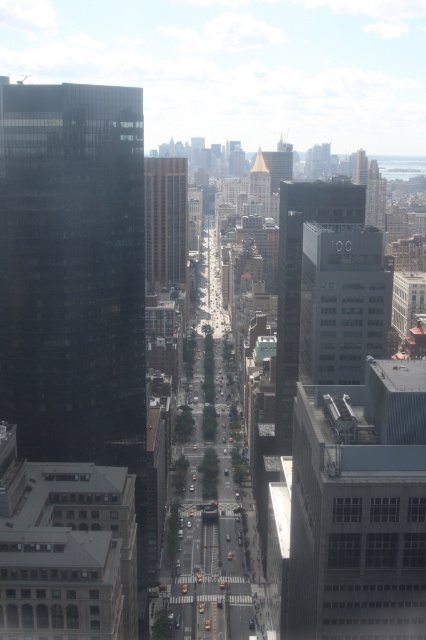
This screenshot has height=640, width=426. What do you see at coordinates (342, 301) in the screenshot?
I see `matte glass skyscraper at center` at bounding box center [342, 301].

Does point (319, 349) lie in front of point (265, 192)?

Yes, it is.

Locate an element on the screen. The width and height of the screenshot is (426, 640). matte glass skyscraper at center is located at coordinates (342, 301).

Can you confirm if dark glass skyscraper at center is positioned below gold metallic tower at center?

Correct, dark glass skyscraper at center is located below gold metallic tower at center.

Who is lower down, dark glass skyscraper at center or gold metallic tower at center?

dark glass skyscraper at center

Identify the location of dark glass skyscraper at center. Image resolution: width=426 pixels, height=640 pixels. (299, 276).

At what (x,y) coordinates should I click in order to perform the action: click on dark glass skyscraper at center. Please return your answer as a coordinate pair (x, y). Looking at the image, I should click on (299, 276).

Between dark glass skyscraper at center and gold glass skyscraper at center, which one appears on the left side from the viewer's perspective?

gold glass skyscraper at center is more to the left.

Is dark glass skyscraper at center bigger than gold glass skyscraper at center?

Correct, dark glass skyscraper at center is larger in size than gold glass skyscraper at center.

Looking at this image, who is more forward, [333,188] or [157,170]?

Point [333,188] is more forward.

Locate an element on the screen. The width and height of the screenshot is (426, 640). dark glass skyscraper at center is located at coordinates (299, 276).